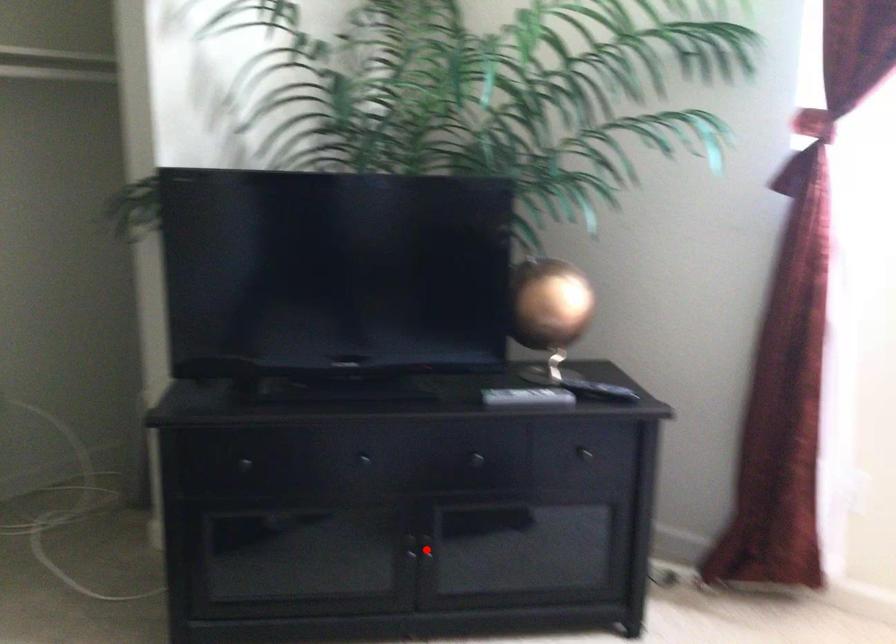
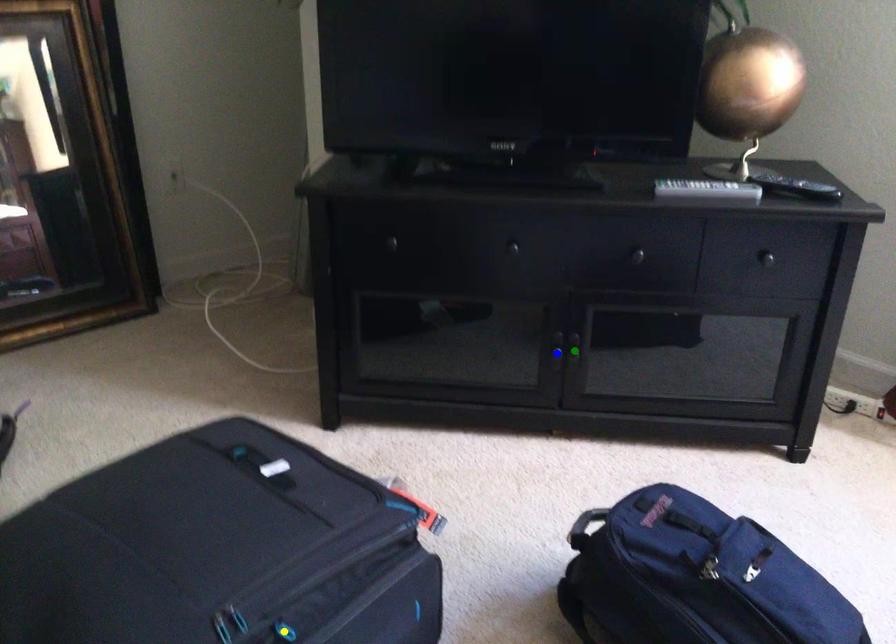
Question: I am providing you with two images of the same scene from different viewpoints. A red point is marked on the first image. You are given multiple points on the second image. Can you choose the point in image 2 that corresponds to the point in image 1?

Choices:
 (A) green point
 (B) blue point
 (C) yellow point

Answer: (A)